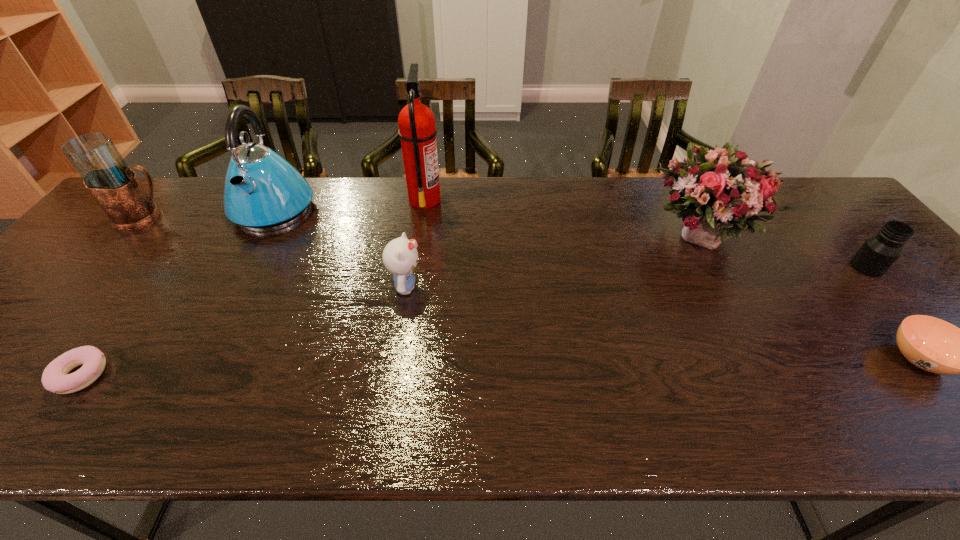
In order to click on free space between the leftmost object and the kitten in this screenshot , I will do `click(276, 252)`.

The image size is (960, 540). What are the coordinates of `free space between the tallest object and the third object from left to right` in the screenshot? It's located at (349, 203).

At what (x,y) coordinates should I click in order to perform the action: click on vacant space that is in between the jar and the kettle. Please return your answer as a coordinate pair (x, y). The image size is (960, 540). Looking at the image, I should click on (570, 237).

In order to click on unoccupied position between the tallest object and the seventh object from right to left in this screenshot , I will do `click(252, 287)`.

Identify which object is located as the second nearest to the leftmost object. Please provide its 2D coordinates. Your answer should be formatted as a tuple, i.e. [(x, y)], where the tuple contains the x and y coordinates of a point satisfying the conditions above.

[(55, 378)]

Select which object appears as the fifth closest to the jar. Please provide its 2D coordinates. Your answer should be formatted as a tuple, i.e. [(x, y)], where the tuple contains the x and y coordinates of a point satisfying the conditions above.

[(263, 192)]

Find the location of a particular element. The width and height of the screenshot is (960, 540). vacant region that satisfies the following two spatial constraints: 1. with the handle on the side of the leftmost object; 2. on the left side of the seventh object from right to left is located at coordinates (12, 375).

Find the location of a particular element. The width and height of the screenshot is (960, 540). vacant space that satisfies the following two spatial constraints: 1. on the front side of the jar; 2. on the front-facing side of the kitten is located at coordinates (884, 287).

The width and height of the screenshot is (960, 540). In order to click on vacant position in the image that satisfies the following two spatial constraints: 1. at the spout of the second tallest object; 2. with the handle on the side of the leftmost object in this screenshot , I will do `click(269, 218)`.

Where is `free space that satisfies the following two spatial constraints: 1. at the spout of the jar; 2. on the right side of the kettle`? This screenshot has height=540, width=960. free space that satisfies the following two spatial constraints: 1. at the spout of the jar; 2. on the right side of the kettle is located at coordinates (243, 267).